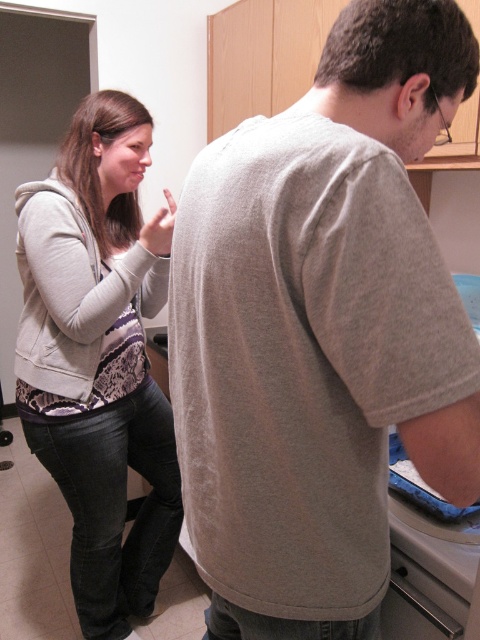
Question: Is gray cotton t-shirt at center in front of light gray hoodie at left?

Choices:
 (A) no
 (B) yes

Answer: (B)

Question: Considering the relative positions of gray cotton t-shirt at center and light gray hoodie at left in the image provided, where is gray cotton t-shirt at center located with respect to light gray hoodie at left?

Choices:
 (A) below
 (B) above

Answer: (B)

Question: Which point is farther to the camera?

Choices:
 (A) (78, 410)
 (B) (316, 141)

Answer: (A)

Question: Can you confirm if gray cotton t-shirt at center is thinner than light gray hoodie at left?

Choices:
 (A) no
 (B) yes

Answer: (A)

Question: Which point is closer to the camera taking this photo?

Choices:
 (A) (289, 436)
 (B) (88, 106)

Answer: (A)